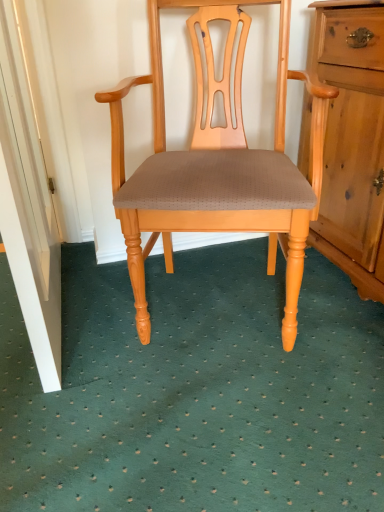
Where is `vacant area located to the right-hand side of white painted wood door at lower left`? vacant area located to the right-hand side of white painted wood door at lower left is located at coordinates (128, 317).